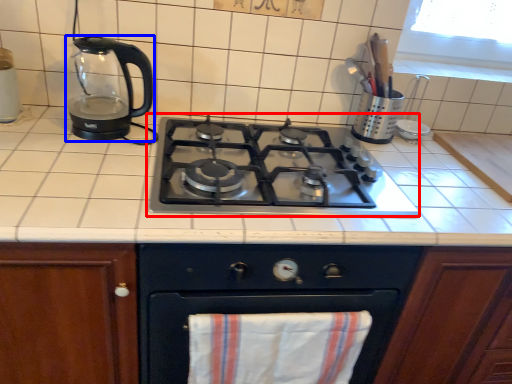
Question: Among these objects, which one is farthest to the camera, gas stove (highlighted by a red box) or kitchen appliance (highlighted by a blue box)?

Choices:
 (A) gas stove
 (B) kitchen appliance

Answer: (B)